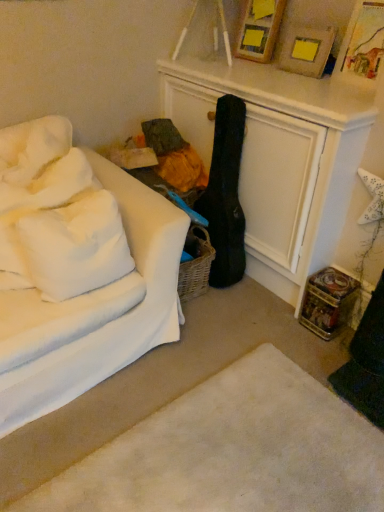
Question: Is wooden picture frame at upper right, the 1th picture frame viewed from the front, wider or thinner than white soft pillow at left, the 1th pillow positioned from the bottom?

Choices:
 (A) wide
 (B) thin

Answer: (B)

Question: Does point (314, 48) appear closer or farther from the camera than point (26, 221)?

Choices:
 (A) farther
 (B) closer

Answer: (A)

Question: Which object is the closest to the white soft rug at lower center?

Choices:
 (A) wooden picture frame at upper right, the 1th picture frame viewed from the front
 (B) wooden picture frame at upper center, the first picture frame in the back-to-front sequence
 (C) white soft pillow at left, which is the second pillow from top to bottom
 (D) white fabric couch at left
 (E) white soft pillow at upper left, which ranks as the 1th pillow in top-to-bottom order

Answer: (D)

Question: Which object is the farthest from the wooden picture frame at upper right, which ranks as the 2th picture frame in back-to-front order?

Choices:
 (A) white fabric couch at left
 (B) white soft pillow at left, which is the second pillow from top to bottom
 (C) white soft pillow at upper left, which ranks as the 1th pillow in top-to-bottom order
 (D) wooden picture frame at upper center, the first picture frame in the back-to-front sequence
 (E) white soft rug at lower center

Answer: (E)